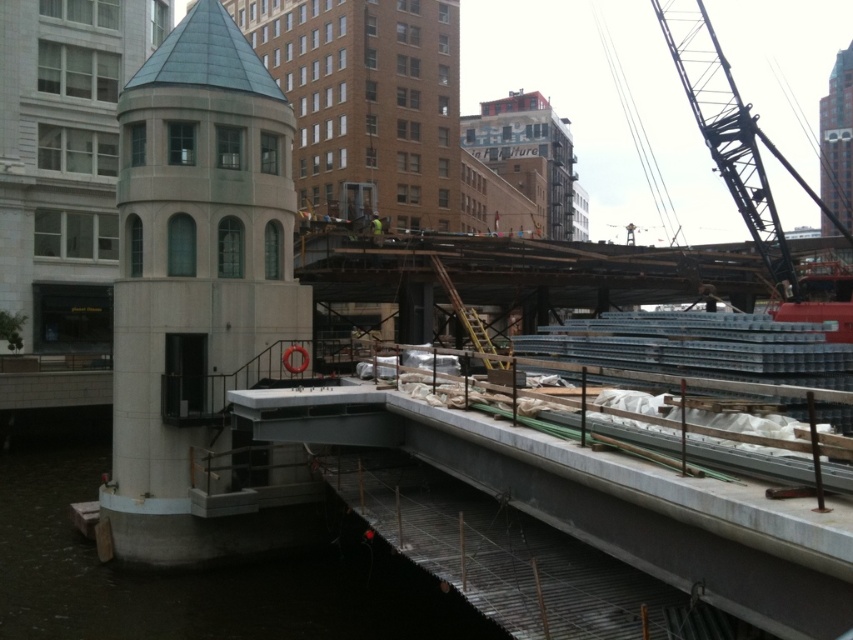
Consider the image. Can you confirm if dark gray concrete waterway at lower left is shorter than metallic industrial crane at upper right?

Yes.

Is dark gray concrete waterway at lower left further to camera compared to metallic industrial crane at upper right?

No, it is not.

Which is behind, point (22, 541) or point (767, 244)?

Positioned behind is point (767, 244).

Identify the location of dark gray concrete waterway at lower left. tap(189, 570).